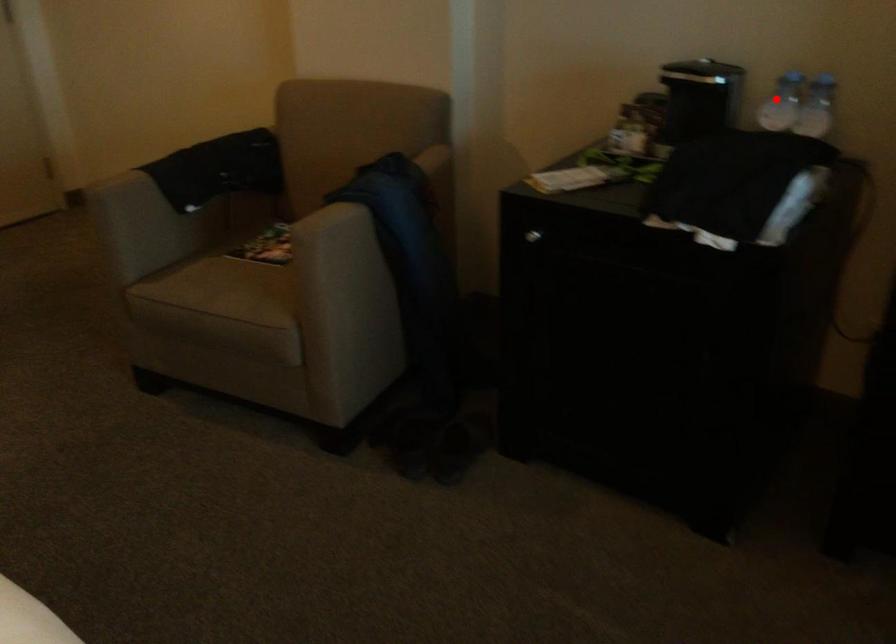
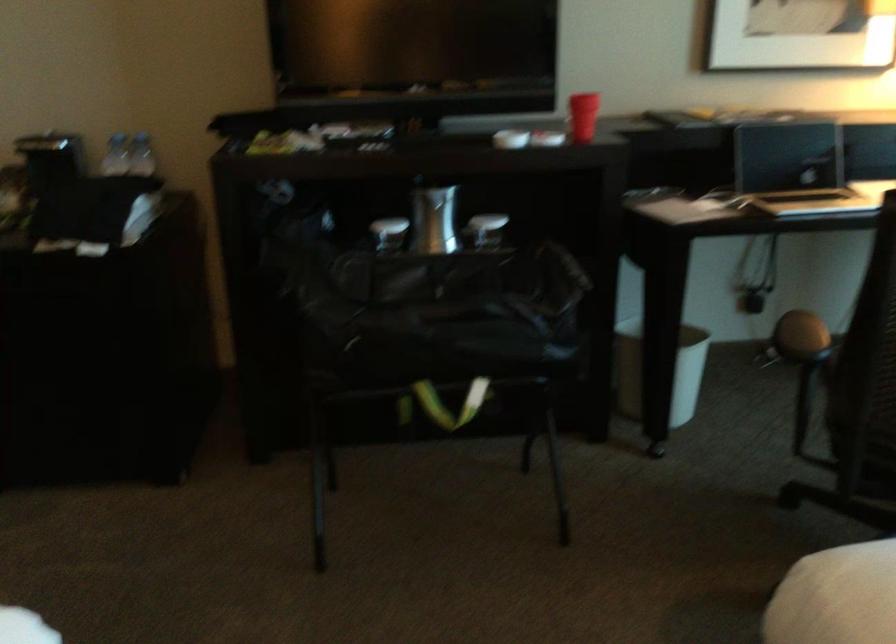
Find the pixel in the second image that matches the highlighted location in the first image.

(115, 156)